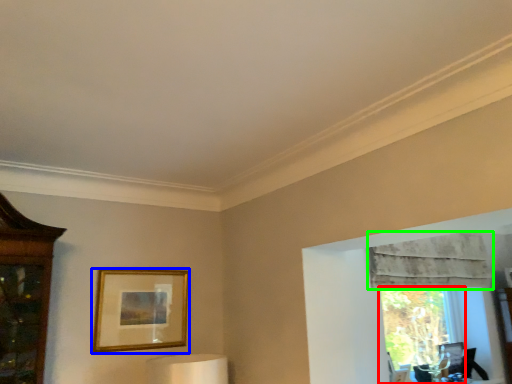
Question: Estimate the real-world distances between objects in this image. Which object is closer to window (highlighted by a red box), picture frame (highlighted by a blue box) or curtain (highlighted by a green box)?

Choices:
 (A) picture frame
 (B) curtain

Answer: (B)